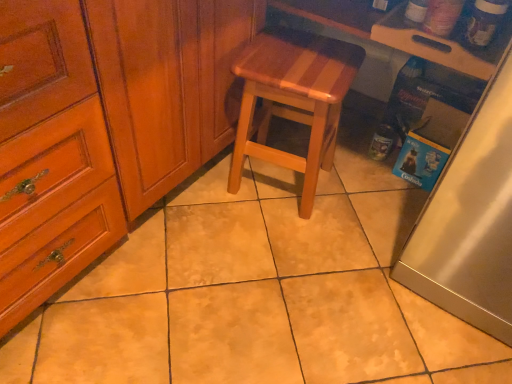
Identify the location of vacant point above natural wood stool at center (from a real-world perspective). pyautogui.click(x=292, y=62).